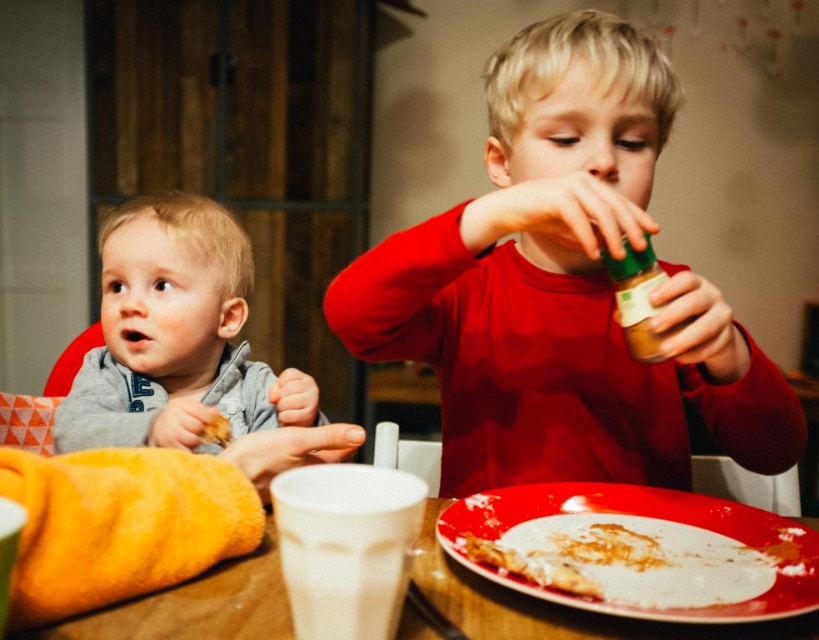
You are a parent trying to dress your child. You have a matte red shirt at center and a gray soft fabric toddler at left. Which clothing item is narrower?

The matte red shirt at center is narrower than the gray soft fabric toddler at left.